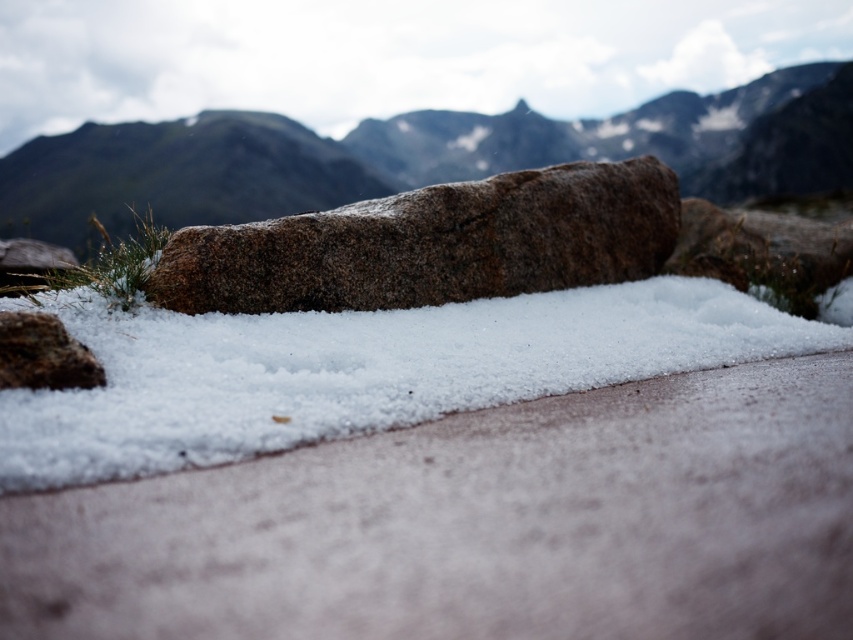
Question: Does white crystalline snow at center have a smaller size compared to granite rock at center?

Choices:
 (A) yes
 (B) no

Answer: (A)

Question: Is white crystalline snow at center further to camera compared to granite rock at center?

Choices:
 (A) yes
 (B) no

Answer: (B)

Question: Does white crystalline snow at center come in front of granite rock at center?

Choices:
 (A) yes
 (B) no

Answer: (A)

Question: Which point is closer to the camera taking this photo?

Choices:
 (A) (647, 241)
 (B) (347, 134)

Answer: (A)

Question: Among these objects, which one is nearest to the camera?

Choices:
 (A) granite rock at center
 (B) granite boulder at center
 (C) white crystalline snow at center

Answer: (C)

Question: Estimate the real-world distances between objects in this image. Which object is farther from the white crystalline snow at center?

Choices:
 (A) granite rock at center
 (B) granite boulder at center

Answer: (A)